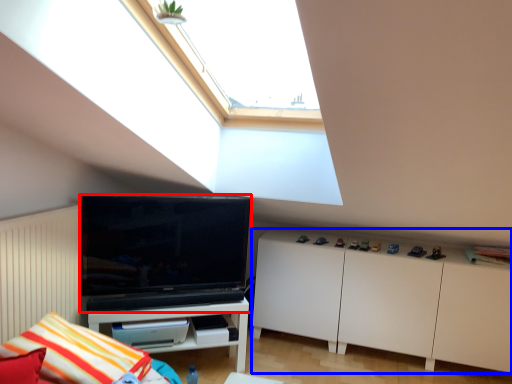
Question: Which point is closer to the camera, television (highlighted by a red box) or cabinetry (highlighted by a blue box)?

Choices:
 (A) television
 (B) cabinetry

Answer: (A)